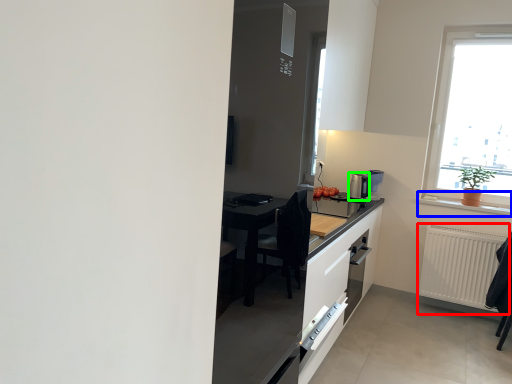
Question: Estimate the real-world distances between objects in this image. Which object is closer to radiator (highlighted by a red box), window sill (highlighted by a blue box) or coffee machine (highlighted by a green box)?

Choices:
 (A) window sill
 (B) coffee machine

Answer: (A)